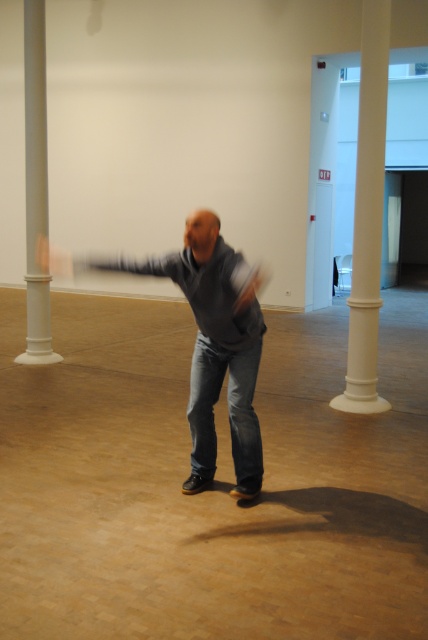
This screenshot has width=428, height=640. What do you see at coordinates (228, 413) in the screenshot?
I see `denim jeans at center` at bounding box center [228, 413].

What do you see at coordinates (228, 413) in the screenshot? I see `denim jeans at center` at bounding box center [228, 413].

Locate an element on the screen. This screenshot has width=428, height=640. denim jeans at center is located at coordinates (228, 413).

Who is more distant from viewer, (201, 451) or (32, 316)?

Positioned behind is point (32, 316).

Between denim jeans at center and white smooth column at left, which one has less height?

Standing shorter between the two is denim jeans at center.

Who is more forward, (231, 392) or (26, 182)?

Positioned in front is point (231, 392).

At what (x,y) coordinates should I click in order to perform the action: click on denim jeans at center. Please return your answer as a coordinate pair (x, y). The height and width of the screenshot is (640, 428). Looking at the image, I should click on (228, 413).

Is gray matte sweater at center above matte gray hand at upper left?

Actually, gray matte sweater at center is below matte gray hand at upper left.

Does point (208, 268) lie in front of point (56, 275)?

No, (208, 268) is behind (56, 275).

Is point (174, 280) positioned after point (45, 244)?

No, (174, 280) is closer to viewer.

I want to click on gray matte sweater at center, so click(213, 346).